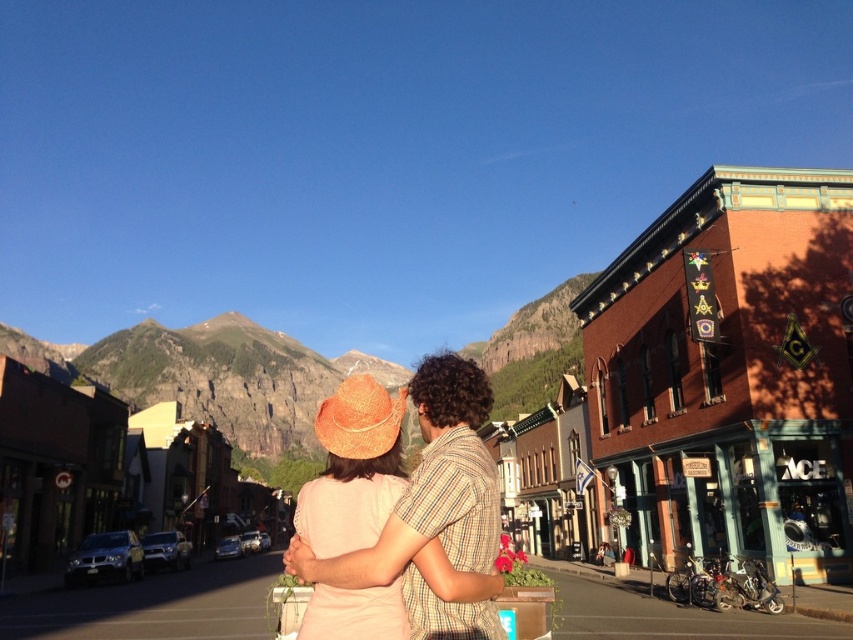
Question: Does straw hat at center have a greater width compared to brown straw hat at center?

Choices:
 (A) yes
 (B) no

Answer: (A)

Question: Which of the following is the closest to the observer?

Choices:
 (A) brown straw hat at center
 (B) straw hat at center

Answer: (B)

Question: Is straw hat at center smaller than brown straw hat at center?

Choices:
 (A) no
 (B) yes

Answer: (B)

Question: Can you confirm if straw hat at center is positioned to the right of brown straw hat at center?

Choices:
 (A) yes
 (B) no

Answer: (A)

Question: Among these objects, which one is farthest from the camera?

Choices:
 (A) brown straw hat at center
 (B) straw hat at center

Answer: (A)

Question: Which point is closer to the camera?

Choices:
 (A) brown straw hat at center
 (B) straw hat at center

Answer: (B)